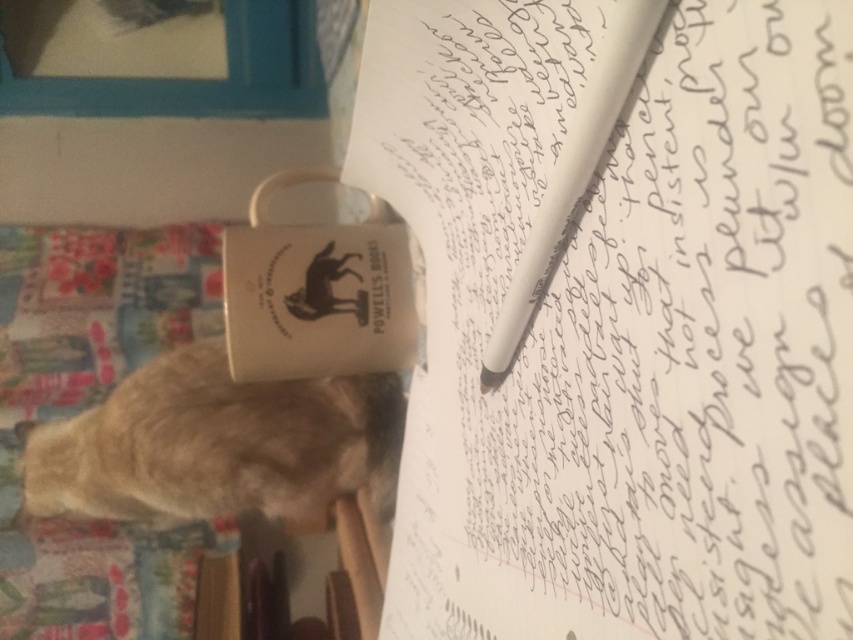
Question: Is white paper at upper center positioned at the back of white matte pen at center?

Choices:
 (A) no
 (B) yes

Answer: (A)

Question: Which object is positioned closest to the white matte paper cup at center?

Choices:
 (A) white matte pen at center
 (B) fuzzy fur cat at lower left

Answer: (B)

Question: Among these objects, which one is nearest to the camera?

Choices:
 (A) white matte pen at center
 (B) fuzzy fur cat at lower left
 (C) white paper at upper center

Answer: (C)

Question: Can you confirm if white matte paper cup at center is bigger than white matte pen at center?

Choices:
 (A) yes
 (B) no

Answer: (A)

Question: Can you confirm if white paper at upper center is wider than fuzzy fur cat at lower left?

Choices:
 (A) no
 (B) yes

Answer: (A)

Question: Among these points, which one is nearest to the camera?

Choices:
 (A) (515, 321)
 (B) (421, 38)
 (C) (323, 413)
 (D) (347, 340)

Answer: (A)